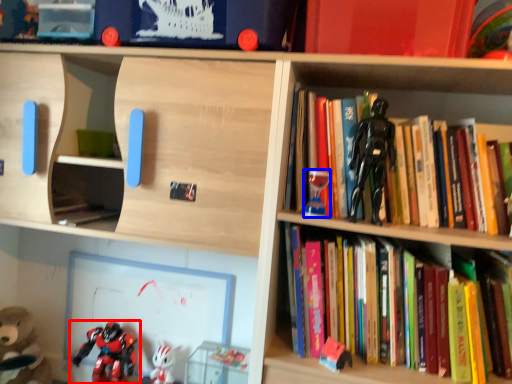
Question: Which point is further to the camera, toy (highlighted by a red box) or toy (highlighted by a blue box)?

Choices:
 (A) toy
 (B) toy

Answer: (A)